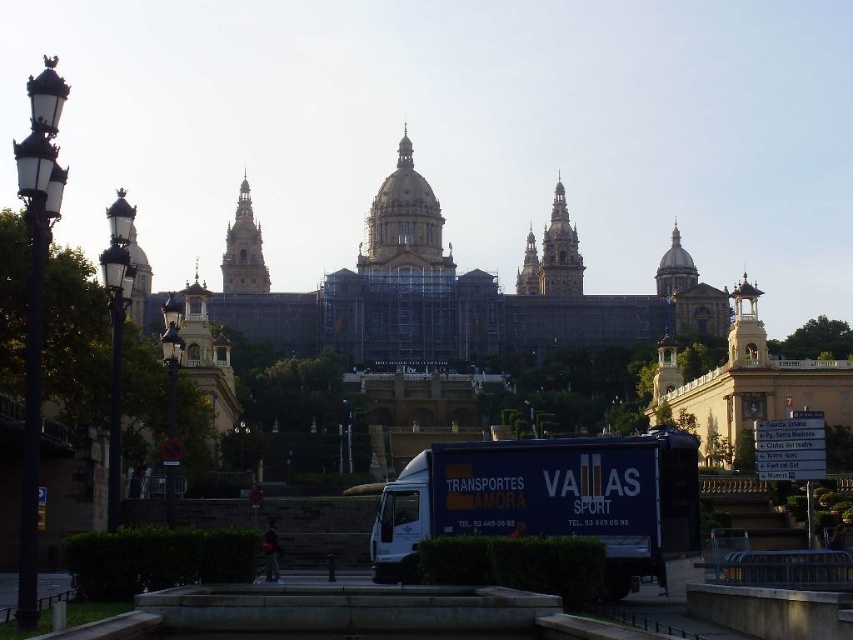
You are standing at the point labeled as point (x=399, y=493) and want to walk to the entrance of the building. There is an obstacle at point (x=524, y=314). Can you walk directly towards the entrance without passing by the obstacle?

Point (x=524, y=314) is behind point (x=399, y=493), so you are already behind the obstacle. Therefore, you can walk directly towards the entrance without passing by the obstacle.

You are a delivery driver who needs to park your blue matte truck at center closer to the golden stone palace at center. Is the truck currently positioned in a way that allows you to move forward to get closer to the palace?

The golden stone palace at center is located above the blue matte truck at center, which means the truck is already positioned below the palace. Since the palace is above, the truck cannot move forward to get closer as it would be obstructed by the palace structure.

From the picture: You are standing at the point marked by the coordinates point (450, 291) in the image. What is the most prominent structure you can see around you?

The point (450, 291) marks the golden stone palace at center, so the most prominent structure around you is the golden stone palace at center.